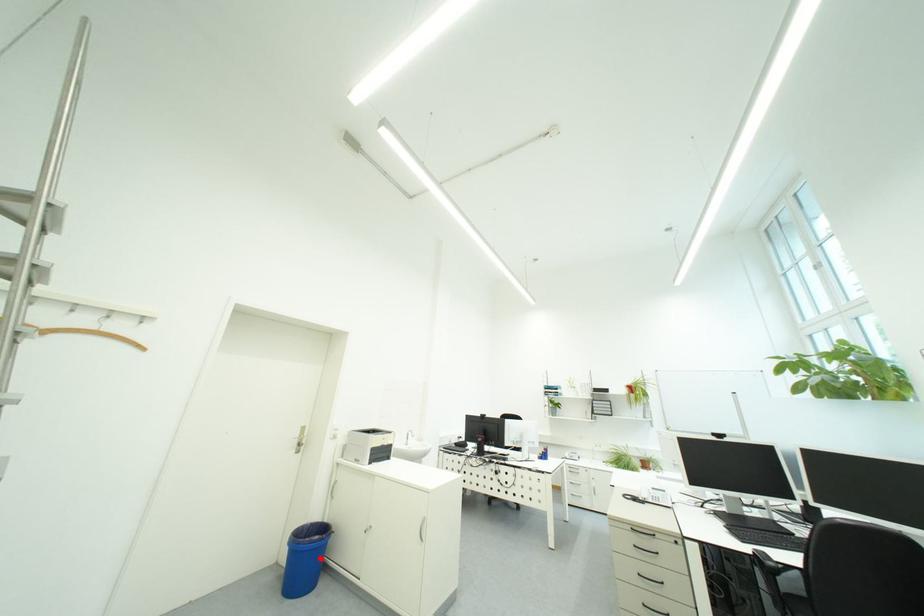
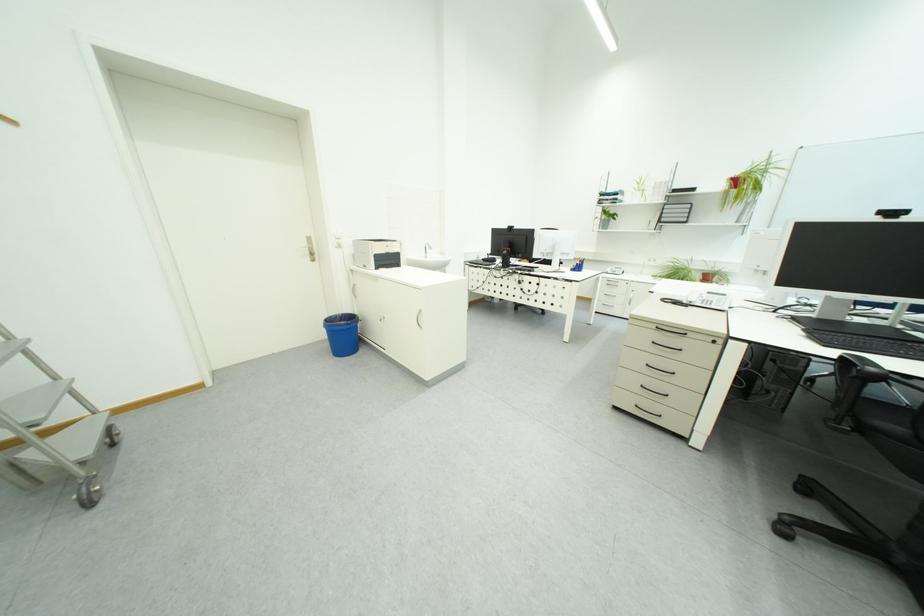
Question: A red point is marked in image1. In image2, is the corresponding 3D point closer to the camera or farther? Reply with the corresponding letter.

Choices:
 (A) The corresponding 3D point is closer.
 (B) The corresponding 3D point is farther.

Answer: (B)